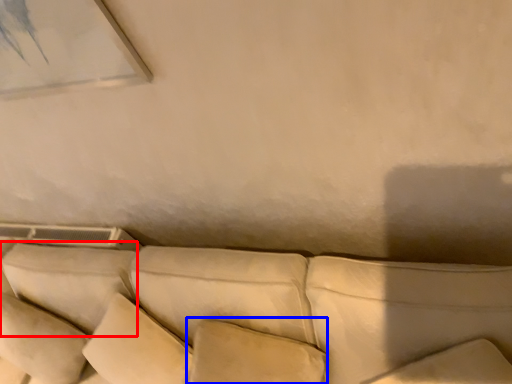
Question: Which of the following is the closest to the observer, pillow (highlighted by a red box) or pillow (highlighted by a blue box)?

Choices:
 (A) pillow
 (B) pillow

Answer: (B)